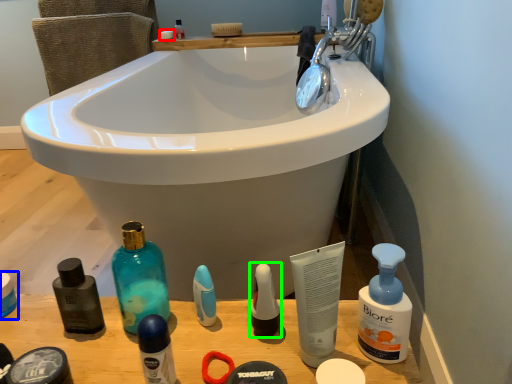
Question: Based on their relative distances, which object is farther from soap (highlighted by a red box)? Choose from personal care (highlighted by a blue box) and toiletry (highlighted by a green box).

Choices:
 (A) personal care
 (B) toiletry

Answer: (B)